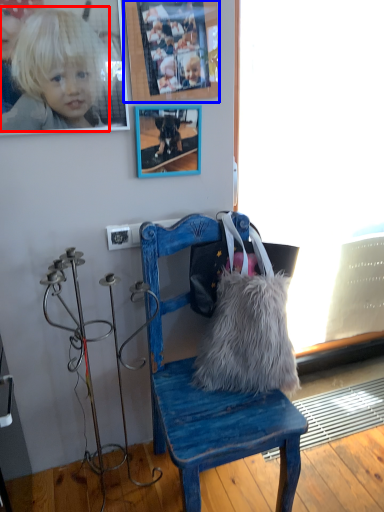
Question: Which of the following is the farthest to the observer, person (highlighted by a red box) or picture frame (highlighted by a blue box)?

Choices:
 (A) person
 (B) picture frame

Answer: (B)